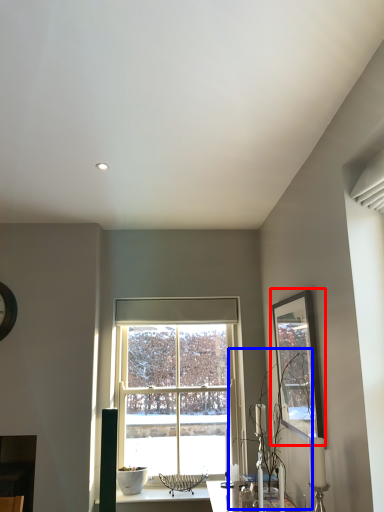
Question: Which point is closer to the camera, picture frame (highlighted by a red box) or plant (highlighted by a blue box)?

Choices:
 (A) picture frame
 (B) plant

Answer: (A)